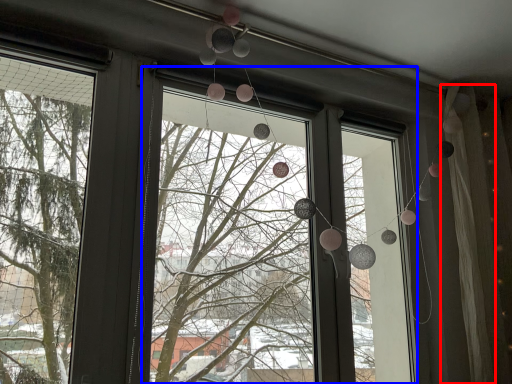
Question: Which point is closer to the camera, curtain (highlighted by a red box) or shop window (highlighted by a blue box)?

Choices:
 (A) curtain
 (B) shop window

Answer: (B)